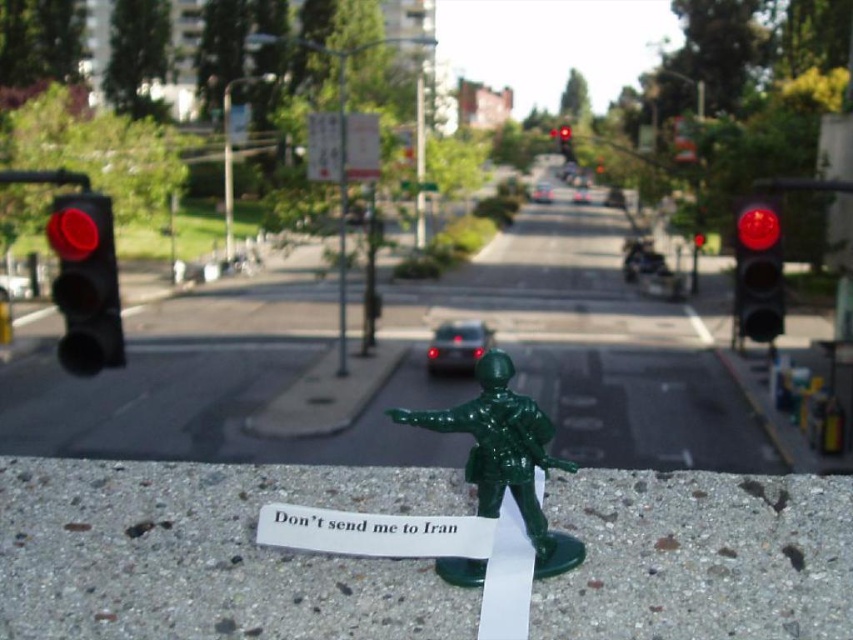
You are a child playing on the sidewalk. You have a green plastic toy soldier at center and a red matte traffic light at center in front of you. Which object can you see as bigger?

The green plastic toy soldier at center is larger in size than the red matte traffic light at center, so the green plastic toy soldier at center appears bigger.

You are a delivery drone flying over the scene. You need to land at the exact location of the black matte traffic light at left. What are the coordinates where you should land?

The black matte traffic light at left is located at coordinates point (86, 282), so you should land there.

You are a delivery drone flying over an urban area. You need to land on the concrete surface where the green plastic toy soldier at center is located. The landing coordinates must be within a 0.1 unit radius of the toy soldier. Can you land safely within that radius?

The green plastic toy soldier at center is positioned at coordinates point (505, 456). Since the landing coordinates must be within a 0.1 unit radius of the toy soldier, the drone can safely land within that radius as long as the landing spot is calculated to be within 0.1 units from point (505, 456).